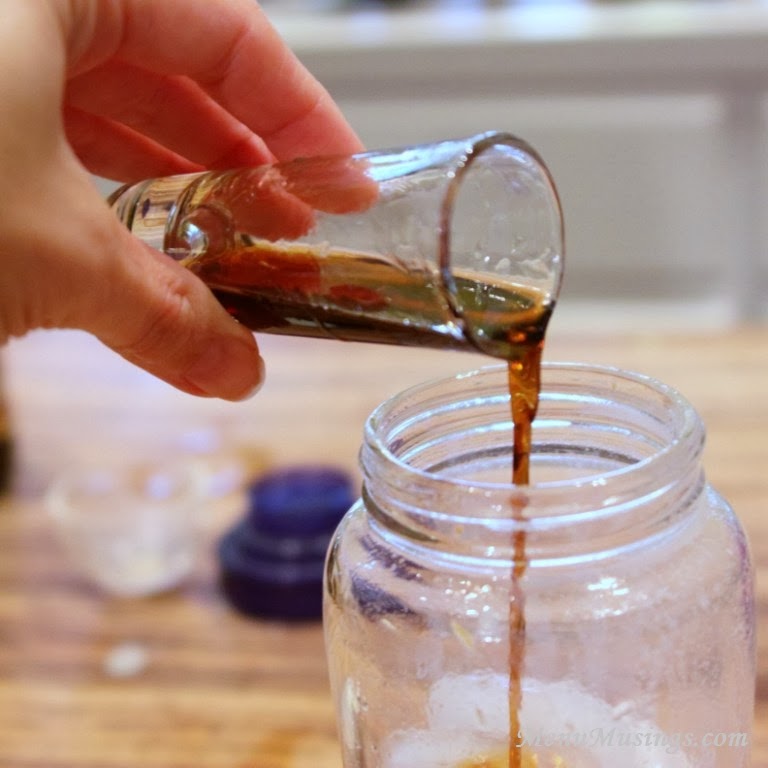
Find the location of a particular element. The image size is (768, 768). shot glass is located at coordinates (399, 232).